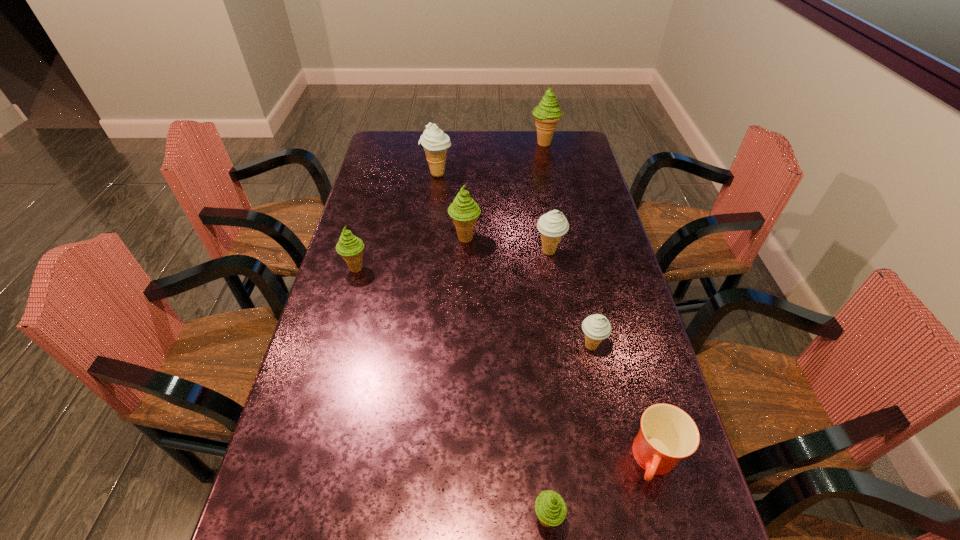
The height and width of the screenshot is (540, 960). What are the coordinates of `vacant area situated 0.270m on the right of the fifth object from right to left` in the screenshot? It's located at (699, 519).

Image resolution: width=960 pixels, height=540 pixels. In order to click on vacant space situated on the back of the cup in this screenshot , I will do `click(612, 305)`.

Locate an element on the screen. The width and height of the screenshot is (960, 540). object located at the far edge is located at coordinates (547, 114).

Identify the location of object that is at the left edge. Image resolution: width=960 pixels, height=540 pixels. (350, 247).

The image size is (960, 540). What are the coordinates of `cup that is at the right edge` in the screenshot? It's located at (667, 434).

Where is `object situated at the far right corner`? object situated at the far right corner is located at coordinates (547, 114).

This screenshot has width=960, height=540. In the image, there is a desktop. What are the coordinates of `free space at the far edge` in the screenshot? It's located at (467, 130).

Locate an element on the screen. This screenshot has width=960, height=540. vacant space at the left edge is located at coordinates (399, 185).

Where is `vacant space at the right edge`? The image size is (960, 540). vacant space at the right edge is located at coordinates (605, 223).

At what (x,y) coordinates should I click in order to perform the action: click on vacant region at the far left corner of the desktop. Please return your answer as a coordinate pair (x, y). The height and width of the screenshot is (540, 960). Looking at the image, I should click on (384, 133).